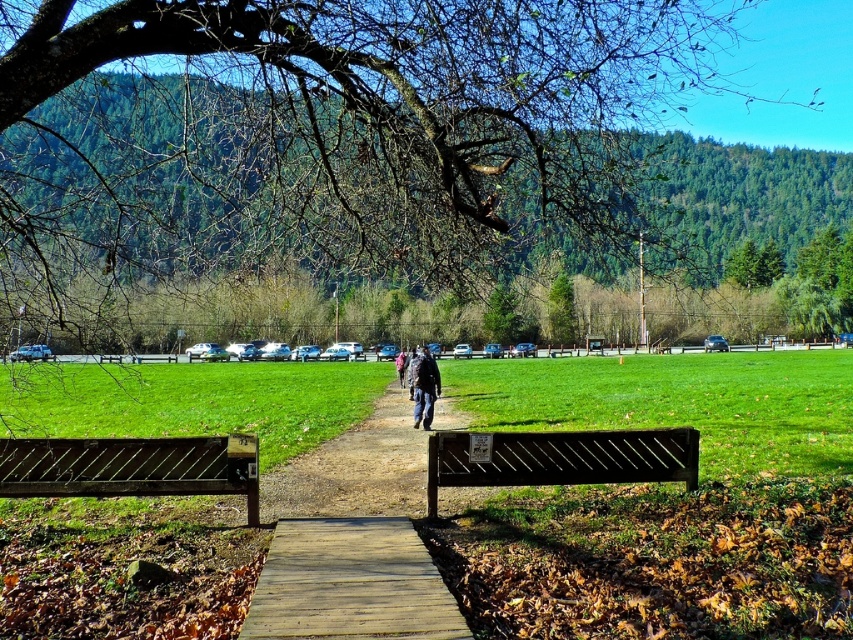
Does bare branches at upper center have a larger size compared to pink fabric jacket at center?

Correct, bare branches at upper center is larger in size than pink fabric jacket at center.

Between point (163, 227) and point (402, 385), which one is positioned in front?

Positioned in front is point (163, 227).

At what (x,y) coordinates should I click in order to perform the action: click on bare branches at upper center. Please return your answer as a coordinate pair (x, y). The width and height of the screenshot is (853, 640). Looking at the image, I should click on (331, 138).

Does rustic wood bench at center have a larger size compared to dark blue jacket at center?

Yes, rustic wood bench at center is bigger than dark blue jacket at center.

Is point (96, 488) closer to camera compared to point (426, 416)?

That is True.

Who is more distant from viewer, [10,484] or [428,365]?

The point [428,365] is behind.

In order to click on rustic wood bench at center in this screenshot , I will do `click(132, 467)`.

Is brown wooden bench at center shorter than pink fabric jacket at center?

Indeed, brown wooden bench at center has a lesser height compared to pink fabric jacket at center.

How much distance is there between brown wooden bench at center and pink fabric jacket at center?

The distance of brown wooden bench at center from pink fabric jacket at center is 11.93 meters.

Does point (677, 412) lie behind point (396, 369)?

No, (677, 412) is closer to viewer.

The height and width of the screenshot is (640, 853). Find the location of `brown wooden bench at center`. brown wooden bench at center is located at coordinates pyautogui.click(x=664, y=502).